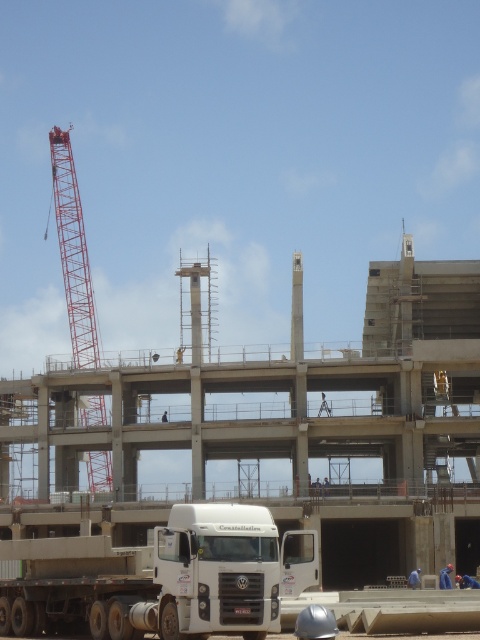
Question: Is white matte truck at lower center above red metal crane at left?

Choices:
 (A) no
 (B) yes

Answer: (A)

Question: Which point appears closest to the camera in this image?

Choices:
 (A) 446,568
 (B) 66,147
 (C) 240,525
 (D) 155,380

Answer: (C)

Question: Is red metal crane at left closer to camera compared to blue fabric construction worker at lower right?

Choices:
 (A) yes
 (B) no

Answer: (B)

Question: Where is concrete at center located in relation to red metal crane at left in the image?

Choices:
 (A) left
 (B) right

Answer: (B)

Question: Which point is closer to the camera?

Choices:
 (A) red metal crane at left
 (B) concrete at center

Answer: (B)

Question: Which of these objects is positioned closest to the blue fabric construction worker at lower right?

Choices:
 (A) concrete at center
 (B) red metal crane at left
 (C) white matte truck at lower center

Answer: (A)